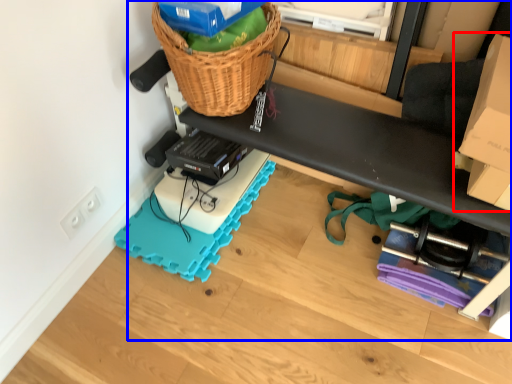
Question: Which of the following is the farthest to the observer, cardboard box (highlighted by a red box) or furniture (highlighted by a blue box)?

Choices:
 (A) cardboard box
 (B) furniture

Answer: (A)